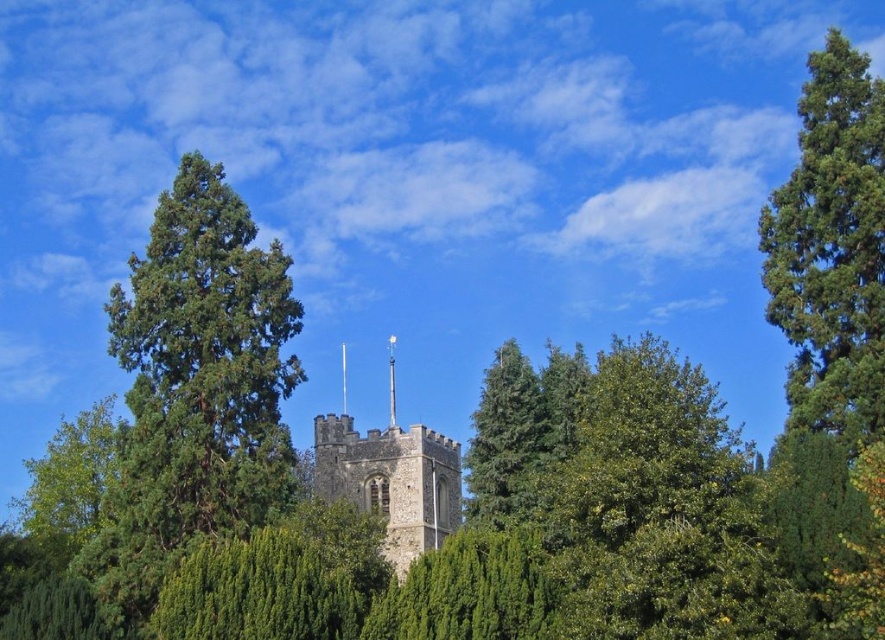
You are an architect analyzing the layout of the scene. Based on the image, which object is located to the right of the other between the stone tower at center and the green textured tree at center?

The stone tower at center is positioned on the left side of green textured tree at center, so the green textured tree at center is to the right of the stone tower at center.

You are a park ranger planning to install a new bench between the green textured pine tree at right and the green textured tree at center. The bench requires a minimum of 30 meters of space between the two trees to ensure visitors can comfortably walk around it. Based on the scene, is the current distance sufficient?

The distance between the green textured pine tree at right and the green textured tree at center is 25.90 meters, which is less than the required 30 meters. Therefore, the current distance is not sufficient for the bench installation with the needed space.

From the picture: You are a park ranger planning to install a new bench between the green textured pine tree at right and the stone tower. The bench requires a minimum of 60 meters of space between the two landmarks to ensure visitor safety. Is the current distance sufficient?

The green textured pine tree at right and the stone tower are 72.24 meters apart, which exceeds the required 60 meters. Therefore, the current distance is sufficient for installing the bench safely.